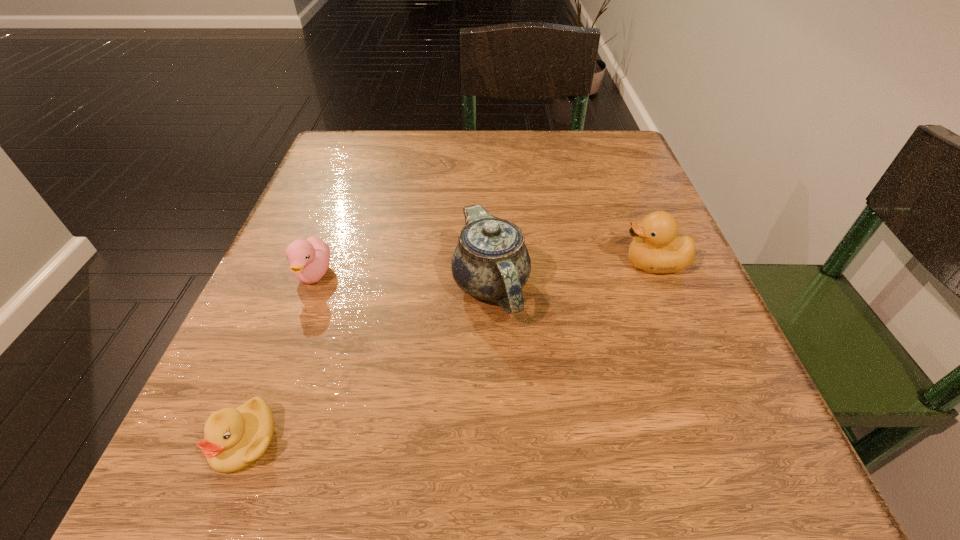
Identify the location of vacant region at the far right corner. (617, 150).

Where is `free point between the tallest duckling and the shortest duckling`? The image size is (960, 540). free point between the tallest duckling and the shortest duckling is located at coordinates [449, 352].

Find the location of `free space between the shortest object and the tallest object`. free space between the shortest object and the tallest object is located at coordinates (368, 363).

Identify the location of free point between the tallest duckling and the shortest duckling. The width and height of the screenshot is (960, 540). (449, 352).

The image size is (960, 540). In order to click on blank region between the tallest object and the tallest duckling in this screenshot , I will do `click(572, 274)`.

Find the location of `free point between the third tallest object and the chinaware`. free point between the third tallest object and the chinaware is located at coordinates (402, 280).

Find the location of a particular element. This screenshot has width=960, height=540. free space between the chinaware and the nearest duckling is located at coordinates (368, 363).

Where is `unoccupied position between the nearest duckling and the third shortest object`? unoccupied position between the nearest duckling and the third shortest object is located at coordinates (449, 352).

This screenshot has height=540, width=960. Find the location of `free point between the tallest object and the shortest duckling`. free point between the tallest object and the shortest duckling is located at coordinates (368, 363).

Locate an element on the screen. This screenshot has width=960, height=540. free space between the third object from left to right and the shortest duckling is located at coordinates (368, 363).